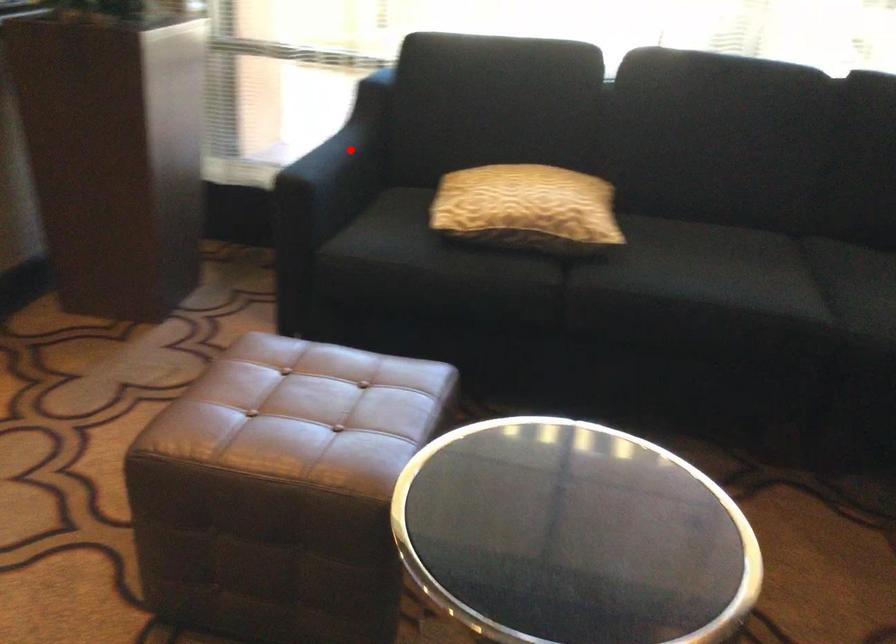
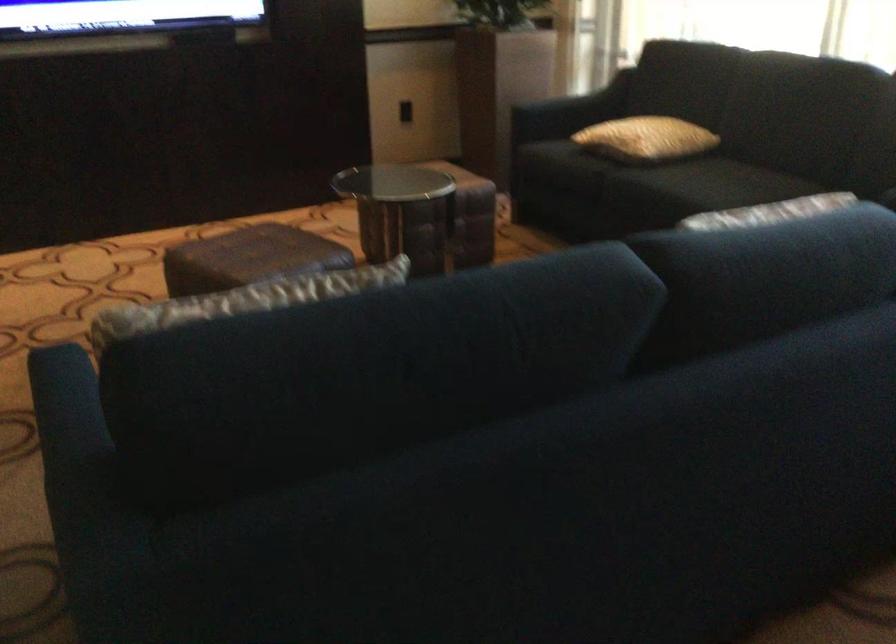
Find the pixel in the second image that matches the highlighted location in the first image.

(586, 99)